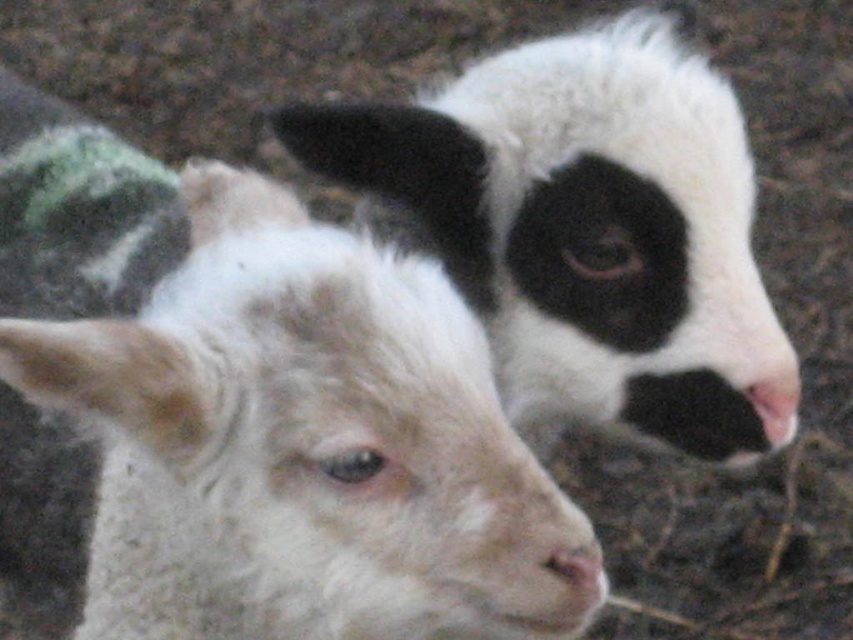
Question: Which is nearer to the white woolen lamb at center?

Choices:
 (A) white soft fur nose at center
 (B) white fluffy goat at upper right

Answer: (A)

Question: Can you confirm if white woolen lamb at center is positioned above white soft fur nose at center?

Choices:
 (A) yes
 (B) no

Answer: (A)

Question: Is white woolen lamb at center above white fluffy goat at upper right?

Choices:
 (A) yes
 (B) no

Answer: (B)

Question: Which of the following is the closest to the observer?

Choices:
 (A) (701, 314)
 (B) (569, 573)
 (C) (460, 456)

Answer: (C)

Question: Can you confirm if white woolen lamb at center is positioned to the left of white soft fur nose at center?

Choices:
 (A) yes
 (B) no

Answer: (A)

Question: Which of the following is the closest to the observer?

Choices:
 (A) white soft fur nose at center
 (B) white fluffy goat at upper right
 (C) white woolen lamb at center

Answer: (C)